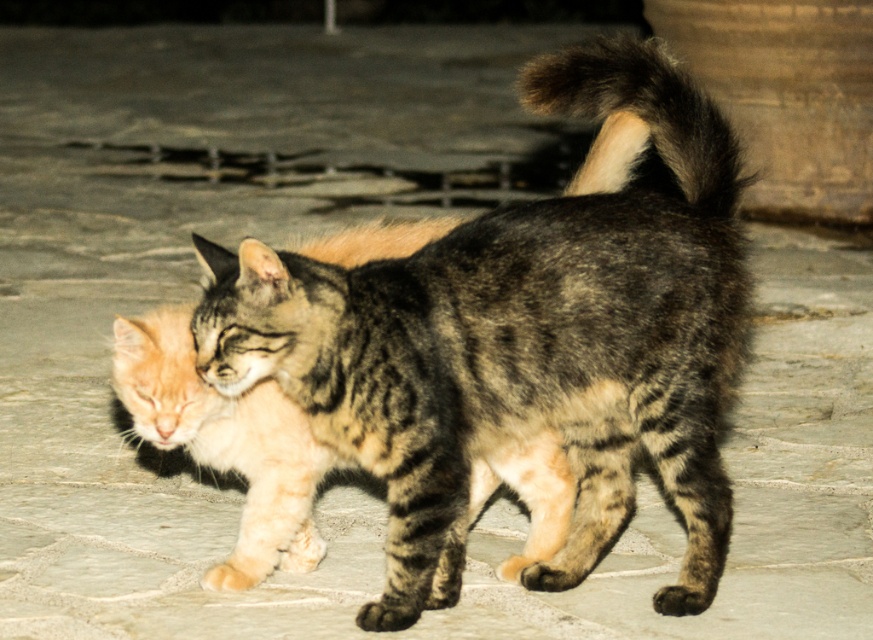
You are a photographer trying to capture both cats in a single frame. Given that the orange fur cat at center is wider than the dark brown fur tail at upper right, which cat should you focus on to ensure both fit in the frame?

The orange fur cat at center is wider than the dark brown fur tail at upper right, so focusing on the orange fur cat at center would ensure both fit in the frame as it occupies more space.

You are standing in the courtyard and see two points marked in the image. Which point is closer to you, point [177,394] or point [597,90]?

Point [177,394] is closer to you because it is further to the viewer than point [597,90].

You are a photographer trying to capture the orange fur cat at center in the image. The camera has a focus point at coordinate point (225, 442). Will this focus point help you capture the orange fur cat at center clearly?

Yes, the orange fur cat at center is located at point (225, 442), so the focus point will help capture it clearly.